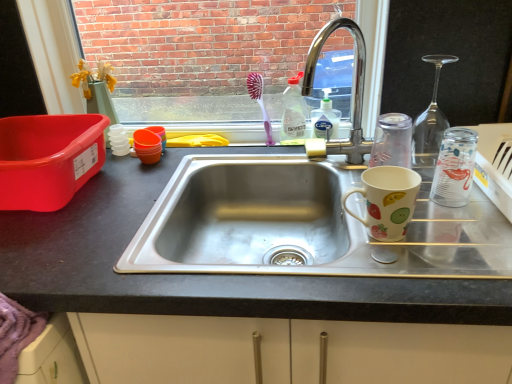
Where is `vacant space in front of matte ceramic mug at right`? This screenshot has height=384, width=512. vacant space in front of matte ceramic mug at right is located at coordinates (397, 283).